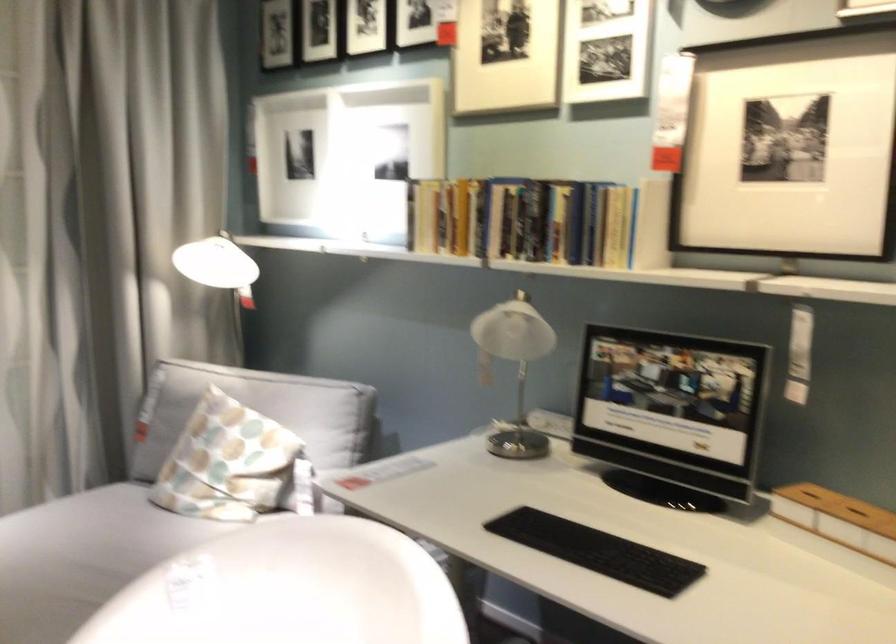
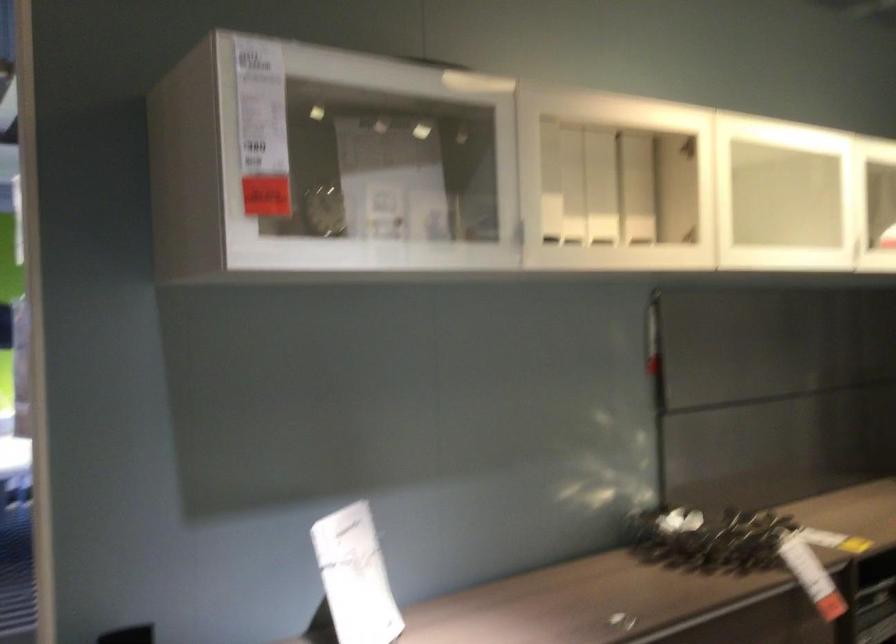
Question: The camera is either moving clockwise (left) or counter-clockwise (right) around the object. The first image is from the beginning of the video and the second image is from the end. Is the camera moving left or right when shooting the video?

Choices:
 (A) Left
 (B) Right

Answer: (B)